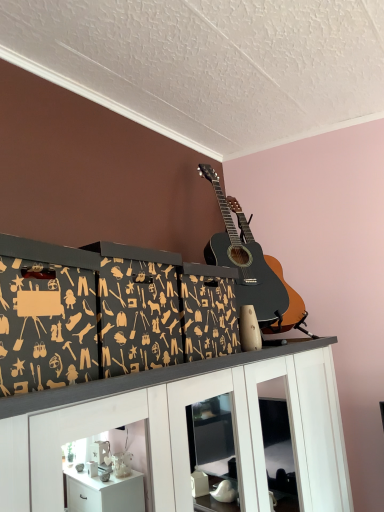
Question: From a real-world perspective, is black acoustic guitar at upper center located higher than white glossy cabinet at upper center?

Choices:
 (A) yes
 (B) no

Answer: (A)

Question: Is black acoustic guitar at upper center at the left side of white glossy cabinet at upper center?

Choices:
 (A) yes
 (B) no

Answer: (B)

Question: Does black acoustic guitar at upper center turn towards white glossy cabinet at upper center?

Choices:
 (A) yes
 (B) no

Answer: (B)

Question: Can you confirm if black acoustic guitar at upper center is smaller than white glossy cabinet at upper center?

Choices:
 (A) no
 (B) yes

Answer: (B)

Question: From the image's perspective, does black acoustic guitar at upper center appear higher than white glossy cabinet at upper center?

Choices:
 (A) yes
 (B) no

Answer: (A)

Question: Does black acoustic guitar at upper center have a lesser height compared to white glossy cabinet at upper center?

Choices:
 (A) no
 (B) yes

Answer: (B)

Question: From the image's perspective, is white glossy cabinet at upper center located above black cardboard boxes at center?

Choices:
 (A) no
 (B) yes

Answer: (A)

Question: Is white glossy cabinet at upper center to the left of black cardboard boxes at center from the viewer's perspective?

Choices:
 (A) no
 (B) yes

Answer: (A)

Question: Is white glossy cabinet at upper center wider than black cardboard boxes at center?

Choices:
 (A) no
 (B) yes

Answer: (B)

Question: Is white glossy cabinet at upper center outside black cardboard boxes at center?

Choices:
 (A) no
 (B) yes

Answer: (B)

Question: Could black cardboard boxes at center be considered to be inside white glossy cabinet at upper center?

Choices:
 (A) yes
 (B) no

Answer: (B)

Question: Is white glossy cabinet at upper center at the right side of black cardboard boxes at center?

Choices:
 (A) yes
 (B) no

Answer: (A)

Question: Can you confirm if black cardboard boxes at center is thinner than white glossy cabinet at upper center?

Choices:
 (A) yes
 (B) no

Answer: (A)